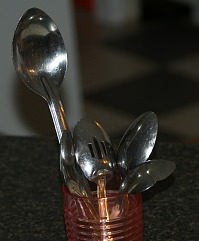
Locate an element on the screen. The height and width of the screenshot is (241, 199). glass is located at coordinates (95, 211).